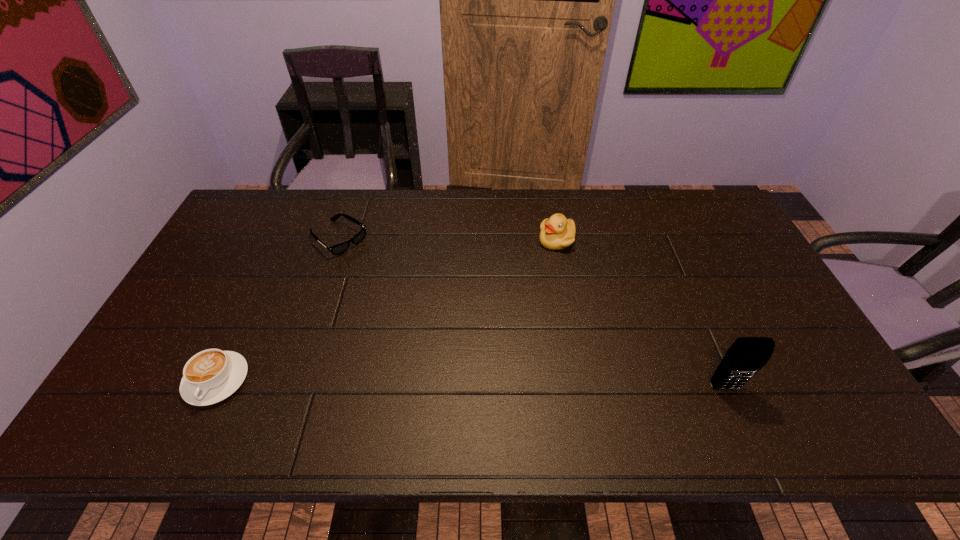
Identify the location of free space between the sunglasses and the cappuccino. This screenshot has width=960, height=540. (277, 309).

This screenshot has width=960, height=540. Find the location of `free space between the rightmost object and the shortest object`. free space between the rightmost object and the shortest object is located at coordinates (532, 313).

Where is `empty location between the shortest object and the cellular telephone`? Image resolution: width=960 pixels, height=540 pixels. empty location between the shortest object and the cellular telephone is located at coordinates (532, 313).

Identify which object is the nearest to the second shortest object. Please provide its 2D coordinates. Your answer should be formatted as a tuple, i.e. [(x, y)], where the tuple contains the x and y coordinates of a point satisfying the conditions above.

[(337, 249)]

This screenshot has height=540, width=960. I want to click on object that is the closest to the leftmost object, so click(x=337, y=249).